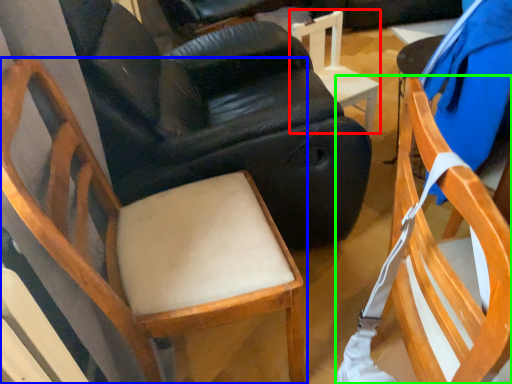
Question: Which is farther away from chair (highlighted by a red box)? chair (highlighted by a blue box) or chair (highlighted by a green box)?

Choices:
 (A) chair
 (B) chair

Answer: (B)